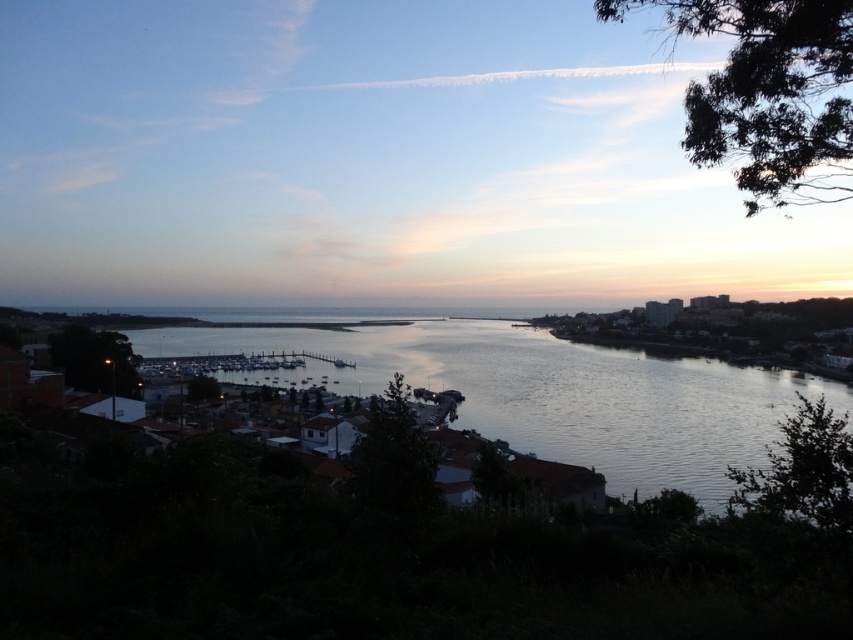
Question: Which point appears farthest from the camera in this image?

Choices:
 (A) click(345, 369)
 (B) click(712, 266)

Answer: (B)

Question: Can you confirm if pastel sky at center is positioned above silvery water at center?

Choices:
 (A) yes
 (B) no

Answer: (A)

Question: Where is pastel sky at center located in relation to silvery water at center in the image?

Choices:
 (A) above
 (B) below

Answer: (A)

Question: Can you confirm if pastel sky at center is smaller than silvery water at center?

Choices:
 (A) no
 (B) yes

Answer: (A)

Question: Among these points, which one is nearest to the camera?

Choices:
 (A) (550, 381)
 (B) (461, 236)

Answer: (A)

Question: Which of the following is the closest to the observer?

Choices:
 (A) pos(701,472)
 (B) pos(729,259)

Answer: (A)